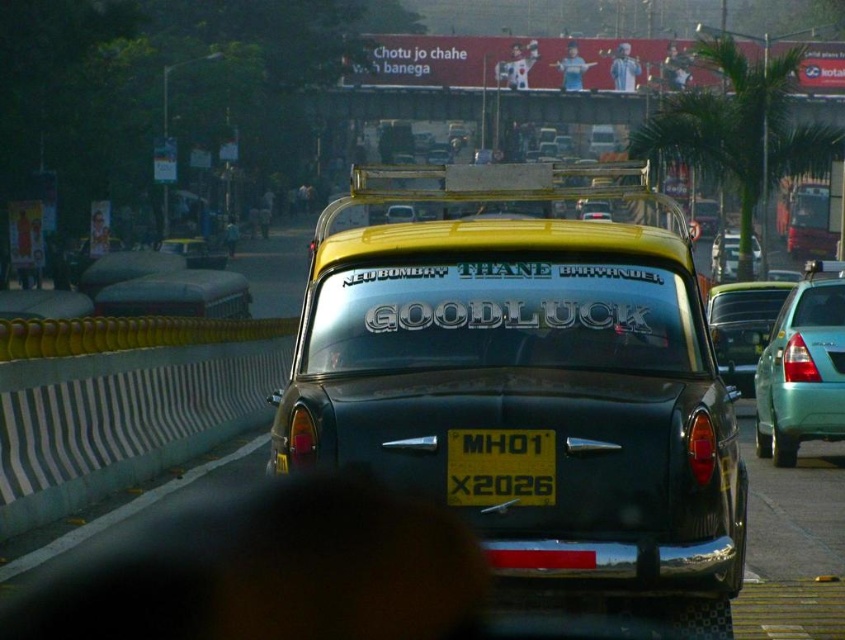
Between shiny black taxi at center and matte black taxi at center, which one is positioned lower?

Positioned lower is shiny black taxi at center.

Can you confirm if shiny black taxi at center is positioned to the right of matte black taxi at center?

Yes, shiny black taxi at center is to the right of matte black taxi at center.

Locate an element on the screen. Image resolution: width=845 pixels, height=640 pixels. shiny black taxi at center is located at coordinates (526, 365).

You are a GUI agent. You are given a task and a screenshot of the screen. Output one action in this format:
    pyautogui.click(x=<x>, y=<y>)
    Task: Click on the shiny black taxi at center
    The image size is (845, 640).
    Given the screenshot: What is the action you would take?
    pyautogui.click(x=526, y=365)

Is the position of green leafy palm tree at upper right more distant than that of teal matte sedan at right?

Yes, green leafy palm tree at upper right is behind teal matte sedan at right.

Is green leafy palm tree at upper right shorter than teal matte sedan at right?

In fact, green leafy palm tree at upper right may be taller than teal matte sedan at right.

Where is `green leafy palm tree at upper right`? Image resolution: width=845 pixels, height=640 pixels. green leafy palm tree at upper right is located at coordinates 739,129.

Is point (502, 442) positioned in front of point (731, 241)?

Yes, it is.

Between point (522, 474) and point (712, 268), which one is positioned behind?

Positioned behind is point (712, 268).

Measure the distance between yellow matte license plate at center and camera.

yellow matte license plate at center and camera are 5.07 meters apart from each other.

This screenshot has width=845, height=640. Identify the location of yellow matte license plate at center. (500, 467).